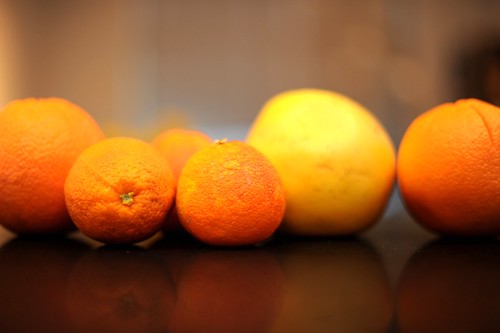
This screenshot has height=333, width=500. What are the coordinates of `shadow of tangerine on table` in the screenshot? It's located at (116, 288), (250, 271).